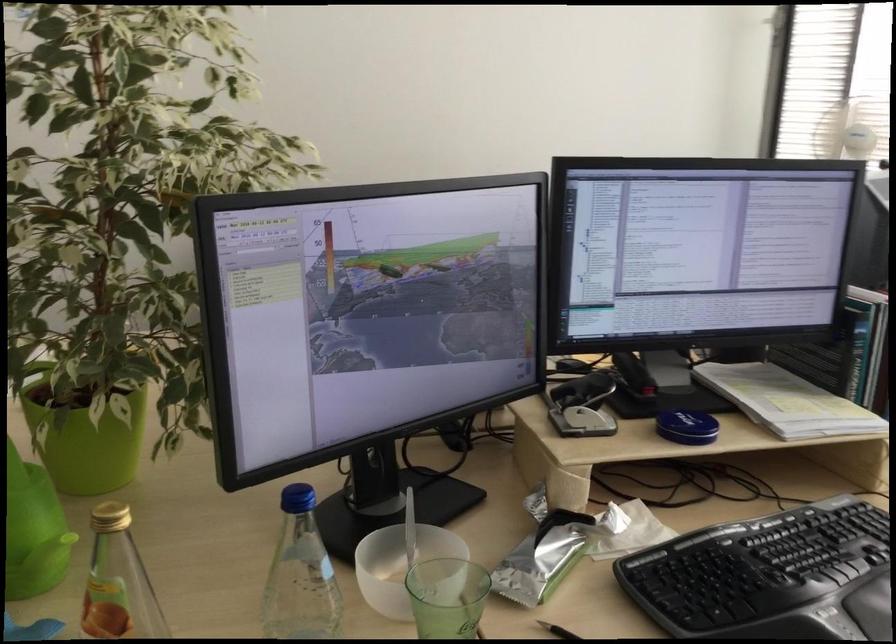
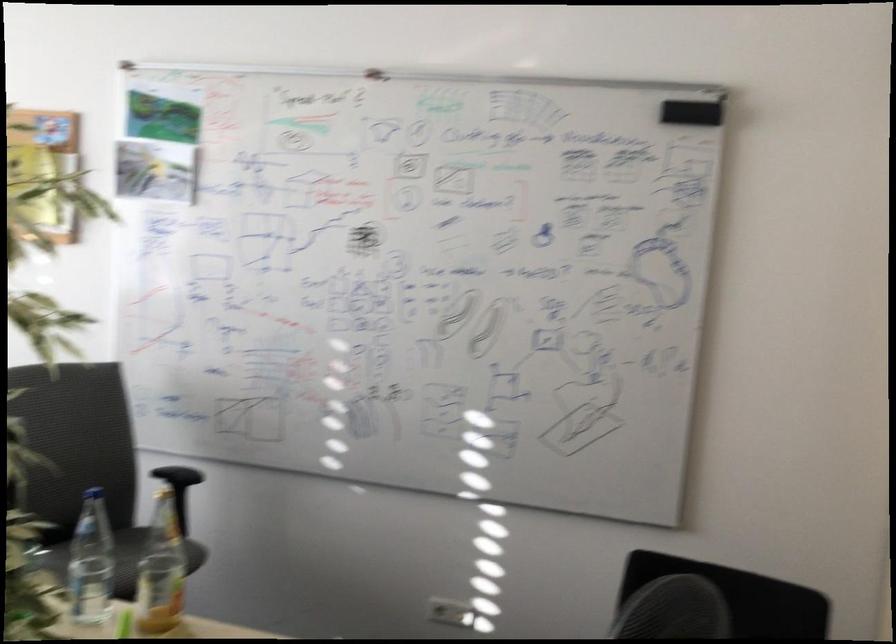
Question: I am providing you with two images of the same scene from different viewpoints. Please identify which objects are invisible in image2.

Choices:
 (A) black chair armrest
 (B) blue tin lid
 (C) black bottle lid
 (D) grey chair sitting surface

Answer: (B)